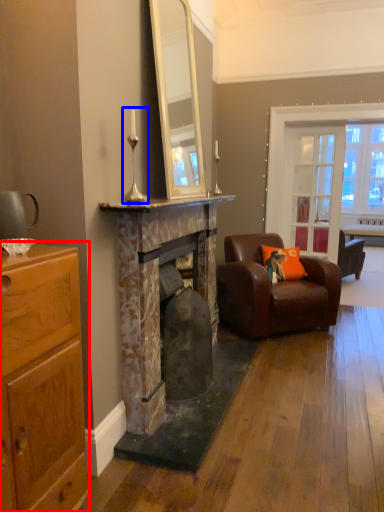
Question: Which object is closer to the camera taking this photo, cabinetry (highlighted by a red box) or table lamp (highlighted by a blue box)?

Choices:
 (A) cabinetry
 (B) table lamp

Answer: (A)